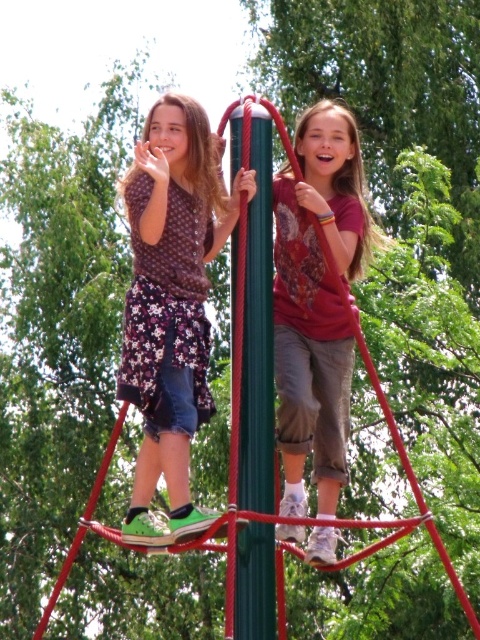
You are standing at the playground structure and see a point at coordinates [316,301]. According to the image, what object is this point located on?

The point at coordinates [316,301] is located on the matte red shirt at center.

You are a photographer standing at the playground. You want to take a photo of the matte red shirt at center and the green polished pole at center. Which object will appear closer to you in the photo?

The matte red shirt at center will appear closer to you in the photo because it is positioned further to the viewer than the green polished pole at center.

You are a photographer trying to capture a photo of the two girls on the playground structure. The scene includes a floral fabric skirt at left and a matte red shirt at center. To ensure both are visible in the frame, which girl should you focus on first?

The floral fabric skirt at left is positioned under the matte red shirt at center, so you should focus on the matte red shirt at center first to ensure it doesn not block the floral fabric skirt at left.